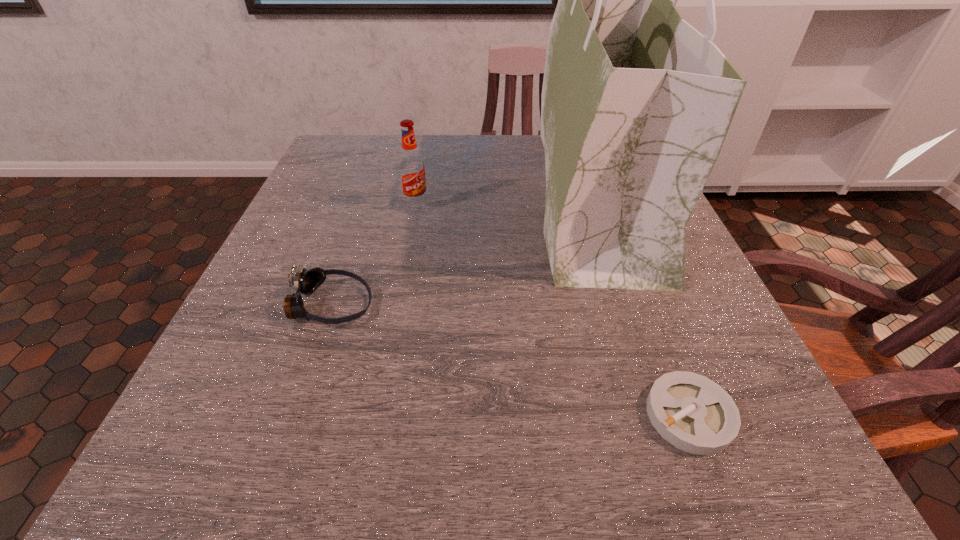
The height and width of the screenshot is (540, 960). In order to click on vacant space at the right edge of the desktop in this screenshot , I will do `click(704, 286)`.

I want to click on free space at the far left corner, so click(x=340, y=145).

Locate an element on the screen. The image size is (960, 540). vacant region between the second object from left to right and the shortest object is located at coordinates (553, 310).

Identify the location of vacant area that lies between the goggles and the third object from right to left. (373, 255).

Find the location of a particular element. vacant area that lies between the grocery bag and the second object from left to right is located at coordinates (507, 201).

Image resolution: width=960 pixels, height=540 pixels. Identify the location of vacant area that lies between the tallest object and the goggles. (465, 251).

Where is `vacant space that is in between the shortest object and the leftmost object`? vacant space that is in between the shortest object and the leftmost object is located at coordinates pos(510,360).

Locate an element on the screen. free space between the grocery bag and the leftmost object is located at coordinates click(465, 251).

Where is `empty space that is in between the second tallest object and the ashtray`? This screenshot has width=960, height=540. empty space that is in between the second tallest object and the ashtray is located at coordinates (553, 310).

Locate an element on the screen. This screenshot has height=540, width=960. free spot between the shortest object and the goggles is located at coordinates (510, 360).